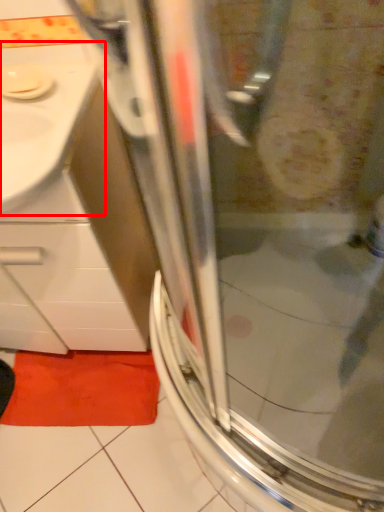
Question: In this image, where is sink (annotated by the red box) located relative to bath mat?

Choices:
 (A) right
 (B) left

Answer: (B)